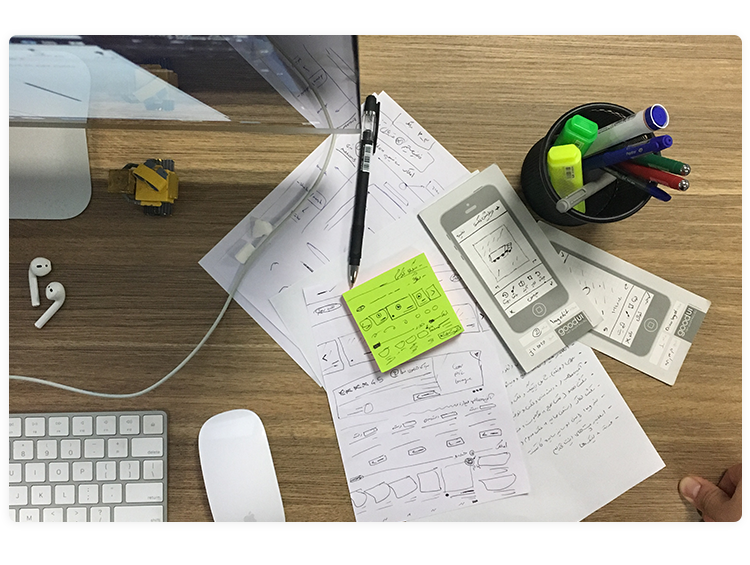
Image resolution: width=750 pixels, height=565 pixels. I want to click on computer mouse, so click(x=220, y=454).